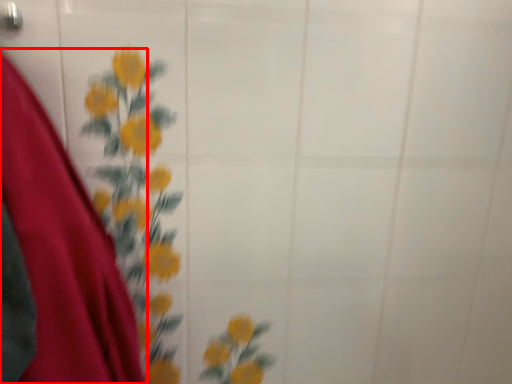
Question: From the image's perspective, where is dress (annotated by the red box) located relative to door handle?

Choices:
 (A) below
 (B) above

Answer: (A)